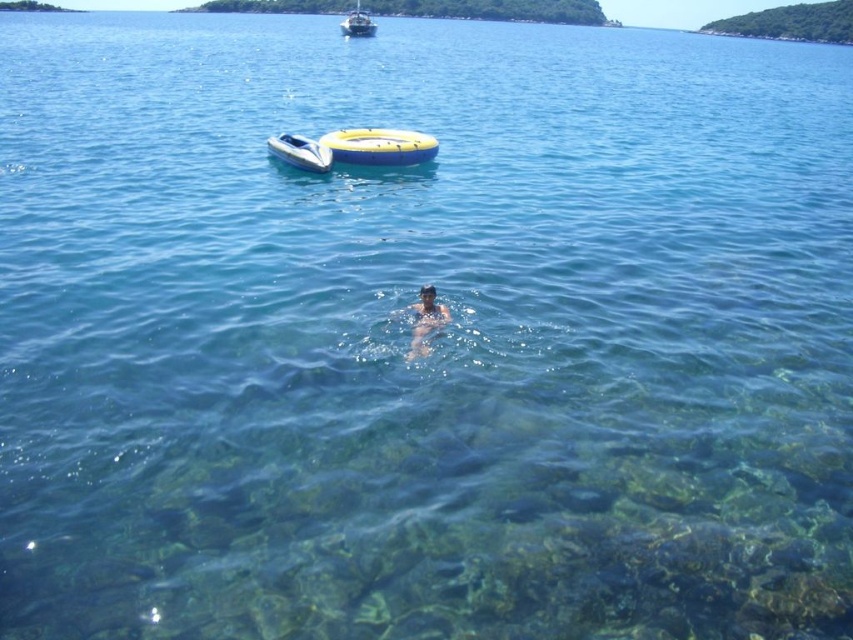
You are a lifeguard on duty and need to reach both the white plastic boat at upper center and the white glossy boat at upper center. Which boat is farther away from the other?

The white plastic boat at upper center is 113.38 meters away from the white glossy boat at upper center, so they are both at the same distance from each other.

You are a swimmer in the water and want to grab an object floating nearby. You can only reach objects that are taller than you. Which object between the yellow rubber ring at upper center and the white plastic boat at upper center should you choose?

The white plastic boat at upper center is taller than the yellow rubber ring at upper center, so you should choose the white plastic boat at upper center because it is taller than you.

You are a swimmer in the water and you see the yellow rubber ring at upper center and the white glossy boat at upper center. Which object is closer to the surface of the water?

The white glossy boat at upper center is closer to the surface of the water because the yellow rubber ring at upper center is located below it.